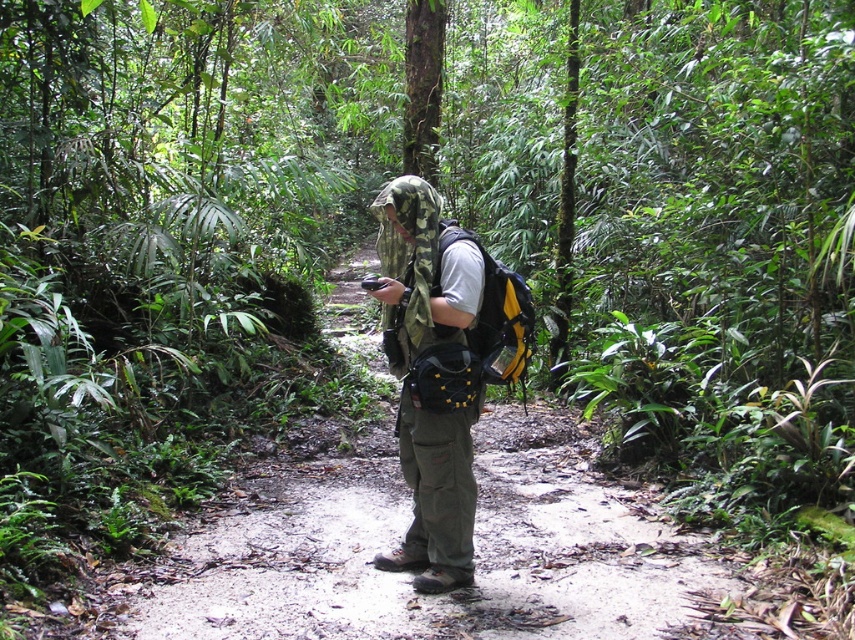
Question: Which of the following is the farthest from the observer?

Choices:
 (A) (505, 477)
 (B) (413, 568)
 (C) (529, 339)

Answer: (A)

Question: Does dull green backpack at center appear on the right side of camouflage fabric hat at center?

Choices:
 (A) no
 (B) yes

Answer: (B)

Question: Is camouflage fabric hat at center above yellow matte backpack at center?

Choices:
 (A) yes
 (B) no

Answer: (B)

Question: Considering the relative positions of camouflage fabric hat at center and yellow matte backpack at center in the image provided, where is camouflage fabric hat at center located with respect to yellow matte backpack at center?

Choices:
 (A) right
 (B) left

Answer: (B)

Question: Which point appears closest to the camera in this image?

Choices:
 (A) (496, 276)
 (B) (529, 628)
 (C) (382, 237)

Answer: (B)

Question: Which point is farther from the camera taking this photo?

Choices:
 (A) (405, 556)
 (B) (481, 305)
 (C) (558, 440)

Answer: (C)